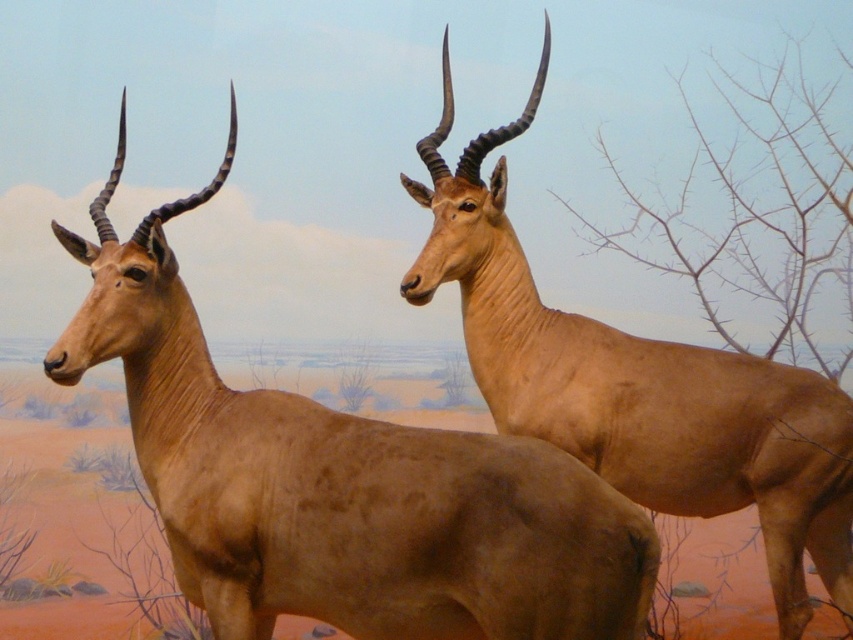
From the picture: Can you confirm if brown matte/deer at left is taller than smooth tan antelope at upper right?

In fact, brown matte/deer at left may be shorter than smooth tan antelope at upper right.

Who is more forward, (186, 371) or (724, 428)?

Positioned in front is point (186, 371).

What do you see at coordinates (341, 483) in the screenshot? I see `brown matte/deer at left` at bounding box center [341, 483].

Identify the location of brown matte/deer at left. (341, 483).